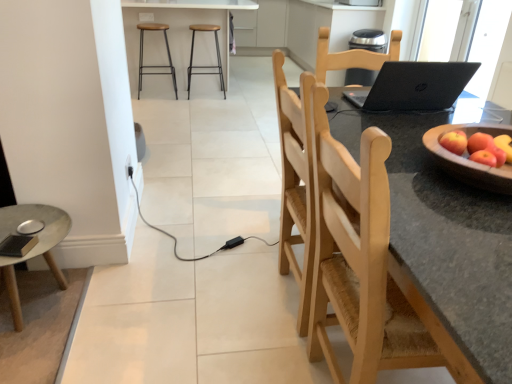
The image size is (512, 384). I want to click on free space on the front side of metallic black stool at upper left, marked as the second stool in a right-to-left arrangement, so click(x=160, y=101).